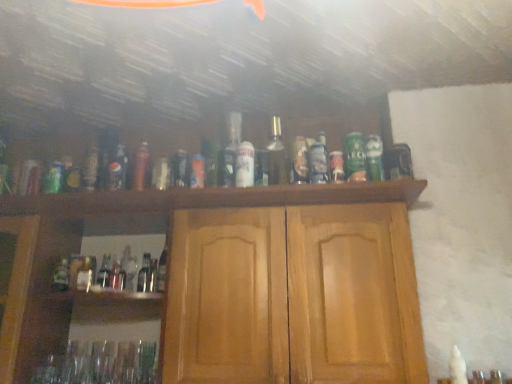
Image resolution: width=512 pixels, height=384 pixels. I want to click on vacant area located to the right-hand side of matte glass bottle at center, the 8th bottle when ordered from left to right, so click(272, 205).